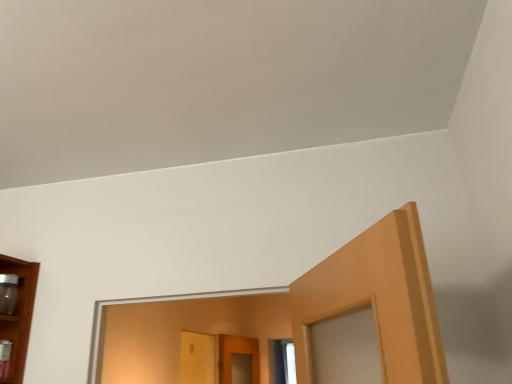
This screenshot has width=512, height=384. Find the location of `wooden shelf at left`. wooden shelf at left is located at coordinates (19, 314).

This screenshot has height=384, width=512. Describe the element at coordinates (19, 314) in the screenshot. I see `wooden shelf at left` at that location.

Image resolution: width=512 pixels, height=384 pixels. I want to click on wooden shelf at left, so click(19, 314).